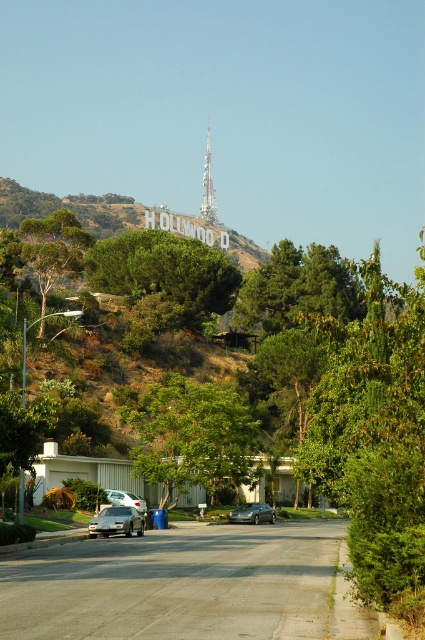
Question: Can you confirm if green leafy tree at center is smaller than silver metallic sedan at center?

Choices:
 (A) no
 (B) yes

Answer: (A)

Question: Considering the real-world distances, which object is farthest from the silver metallic sedan at center?

Choices:
 (A) satin silver sedan at lower left
 (B) satin silver sedan at lower center
 (C) silver metallic tower at upper center
 (D) green leafy tree at left

Answer: (C)

Question: Which point is farther to the camera?

Choices:
 (A) (212, 221)
 (B) (73, 218)
 (C) (118, 513)

Answer: (A)

Question: Among these objects, which one is farthest from the camera?

Choices:
 (A) green leafy tree at center
 (B) satin silver sedan at lower center

Answer: (B)

Question: Is green leafy tree at center positioned behind satin silver sedan at lower center?

Choices:
 (A) no
 (B) yes

Answer: (A)

Question: Can you confirm if green leafy tree at center is positioned to the left of satin silver sedan at lower center?

Choices:
 (A) yes
 (B) no

Answer: (A)